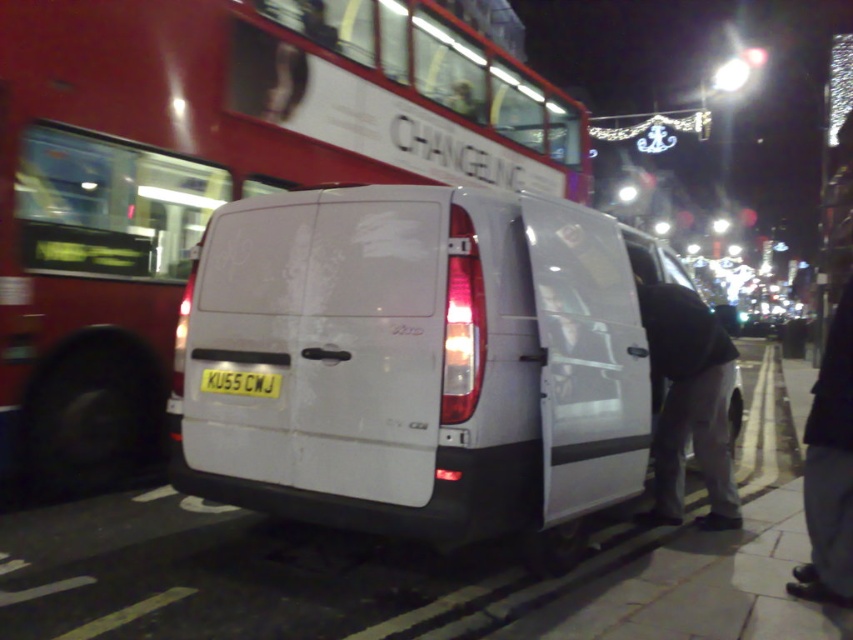
You are a photographer standing in front of the white van with open rear doors. You notice two points marked in the image at coordinates point (279, 264) and point (839, 324). Which point is closer to your camera?

Point (279, 264) is closer to the camera than point (839, 324) because it is further to the camera than the other point.

You are a pedestrian standing on the street looking at the white matte van at center and the black fabric pants at lower right. Which object is higher in the image?

The white matte van at center is higher than the black fabric pants at lower right.

What are the coordinates of the red metallic bus at upper center?

The coordinates of the red metallic bus at upper center are at point (x=210, y=176).